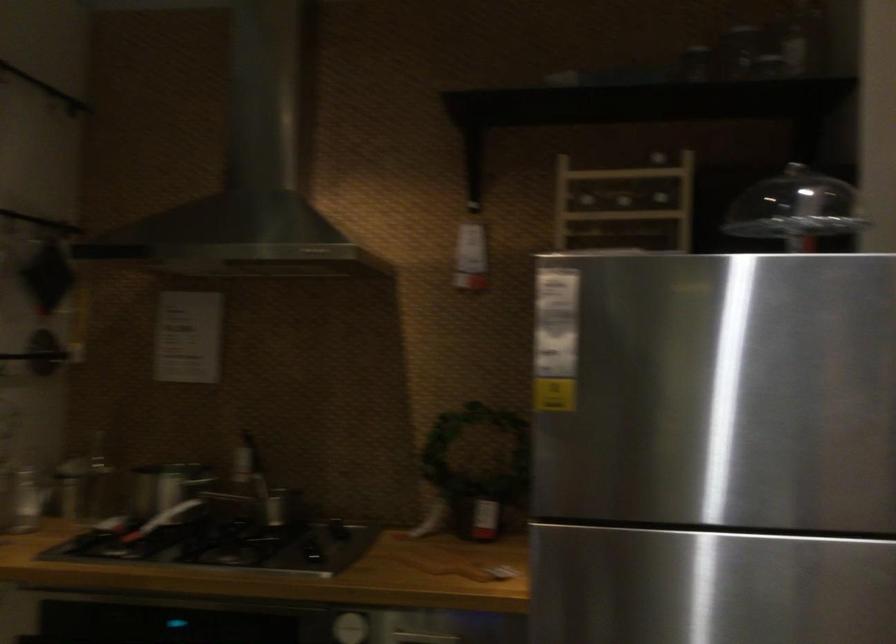
Find where to turn the silver oven dial. Please return your answer as a coordinate pair (x, y).

(350, 627)